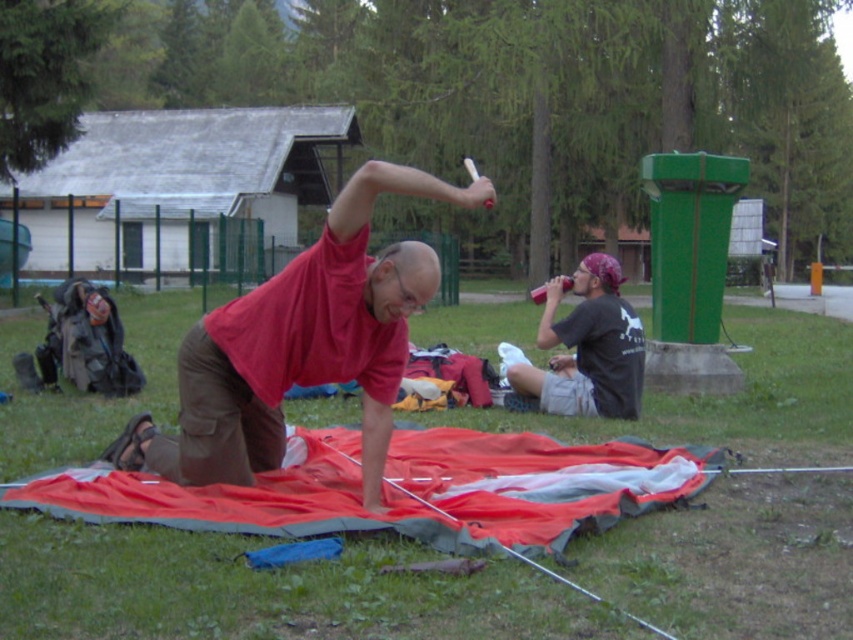
Who is positioned more to the left, green grass at lower center or red fabric blanket at center?

red fabric blanket at center

Can you confirm if green grass at lower center is bigger than red fabric blanket at center?

Yes.

Is point (24, 397) farther from camera compared to point (410, 506)?

Yes, it is behind point (410, 506).

Find the location of `green grass at lower center`. green grass at lower center is located at coordinates point(260,592).

Between point (680, 438) and point (538, 330), which one is positioned behind?

The point (538, 330) is behind.

Who is shorter, green grass at lower center or matte black t-shirt at lower right?

green grass at lower center is shorter.

Does point (136, 566) come behind point (619, 276)?

That is False.

Where is `green grass at lower center`? The image size is (853, 640). green grass at lower center is located at coordinates (260, 592).

Can you confirm if red fabric blanket at center is positioned above matte black t-shirt at lower right?

Incorrect, red fabric blanket at center is not positioned above matte black t-shirt at lower right.

Is red fabric blanket at center to the left of matte black t-shirt at lower right from the viewer's perspective?

Correct, you'll find red fabric blanket at center to the left of matte black t-shirt at lower right.

Who is more distant from viewer, (x=274, y=534) or (x=550, y=296)?

Positioned behind is point (x=550, y=296).

At what (x,y) coordinates should I click in order to perform the action: click on red fabric blanket at center. Please return your answer as a coordinate pair (x, y). Looking at the image, I should click on (404, 486).